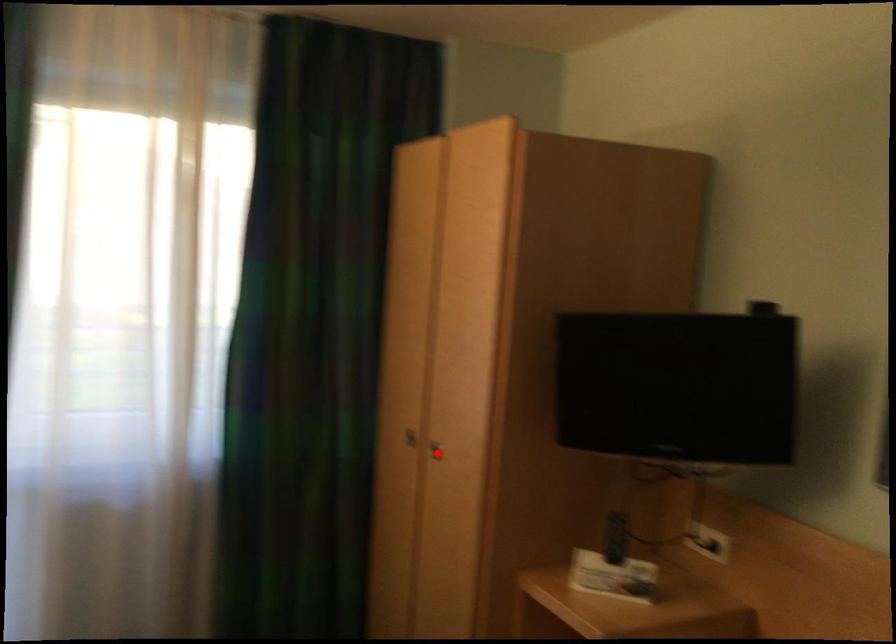
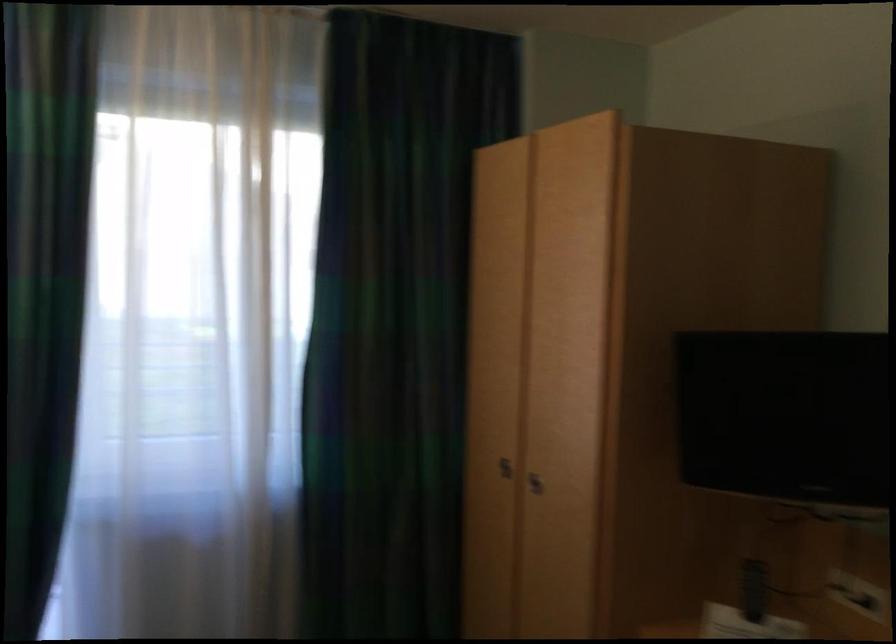
Where in the second image is the point corresponding to the highlighted location from the first image?

(535, 483)